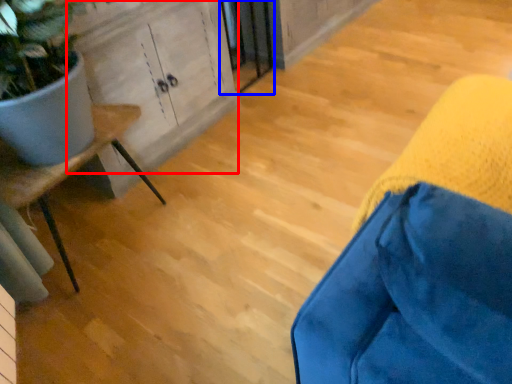
Question: Which object appears farthest to the camera in this image, cabinetry (highlighted by a red box) or screen door (highlighted by a blue box)?

Choices:
 (A) cabinetry
 (B) screen door

Answer: (B)